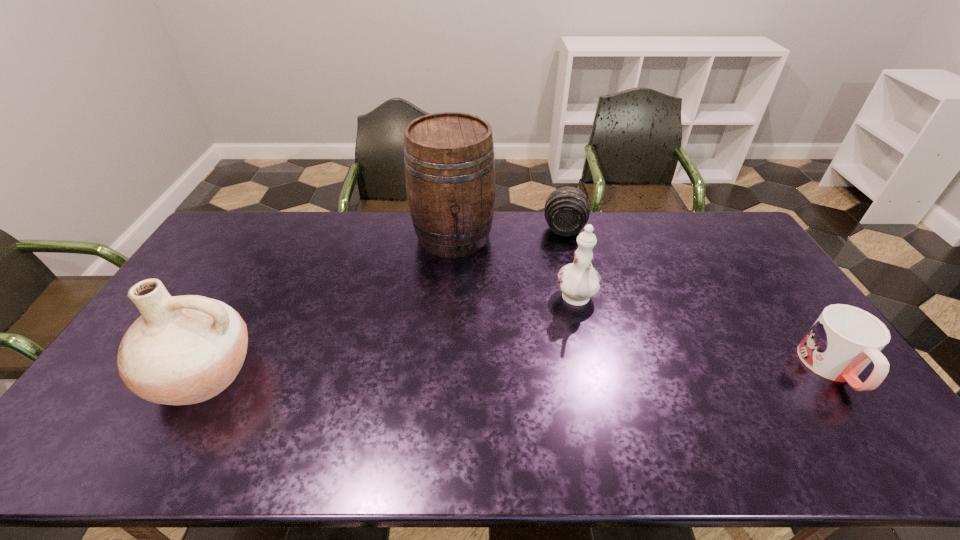
Locate an element on the screen. This screenshot has width=960, height=540. pottery is located at coordinates (182, 350).

Identify the location of the rightmost object. The width and height of the screenshot is (960, 540). coord(844,339).

Where is `the third tallest object`? The width and height of the screenshot is (960, 540). the third tallest object is located at coordinates (578, 281).

Identify the location of the third farthest object. Image resolution: width=960 pixels, height=540 pixels. (578, 281).

Where is `telephoto lens`? Image resolution: width=960 pixels, height=540 pixels. telephoto lens is located at coordinates (567, 209).

Find the location of a particular element. cider is located at coordinates (449, 162).

The height and width of the screenshot is (540, 960). I want to click on the second object from left to right, so click(449, 162).

Locate an element on the screen. vacant space located at the spout of the chinaware is located at coordinates (588, 364).

Locate an element on the screen. The height and width of the screenshot is (540, 960). vacant space situated at the spout of the chinaware is located at coordinates (593, 399).

Find the location of a particular element. blank area located at the spout of the chinaware is located at coordinates (585, 349).